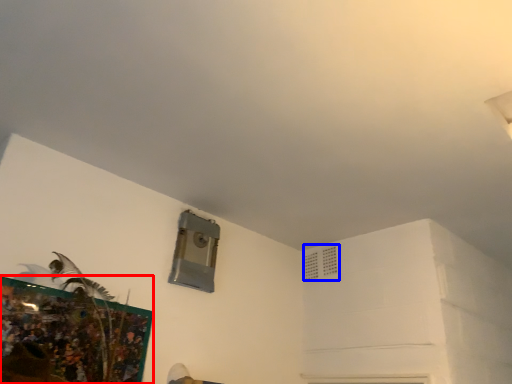
Question: Which object appears farthest to the camera in this image, picture frame (highlighted by a red box) or air conditioning (highlighted by a blue box)?

Choices:
 (A) picture frame
 (B) air conditioning

Answer: (B)